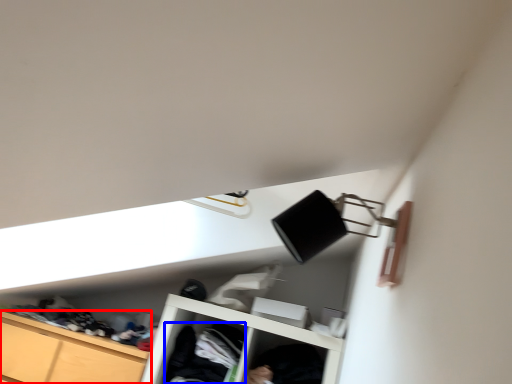
Question: Which object is further to the camera taking this photo, cabinetry (highlighted by a red box) or clothing (highlighted by a blue box)?

Choices:
 (A) cabinetry
 (B) clothing

Answer: (B)